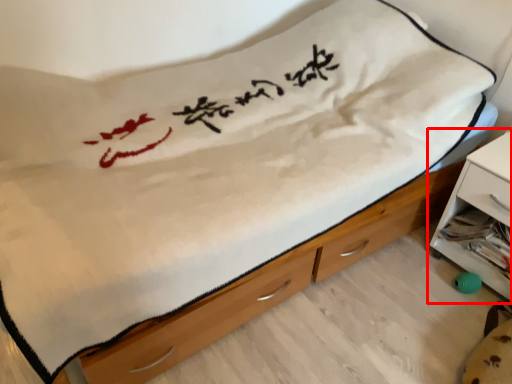
Question: Observing the image, what is the correct spatial positioning of nightstand (annotated by the red box) in reference to chest of drawers?

Choices:
 (A) left
 (B) right

Answer: (B)